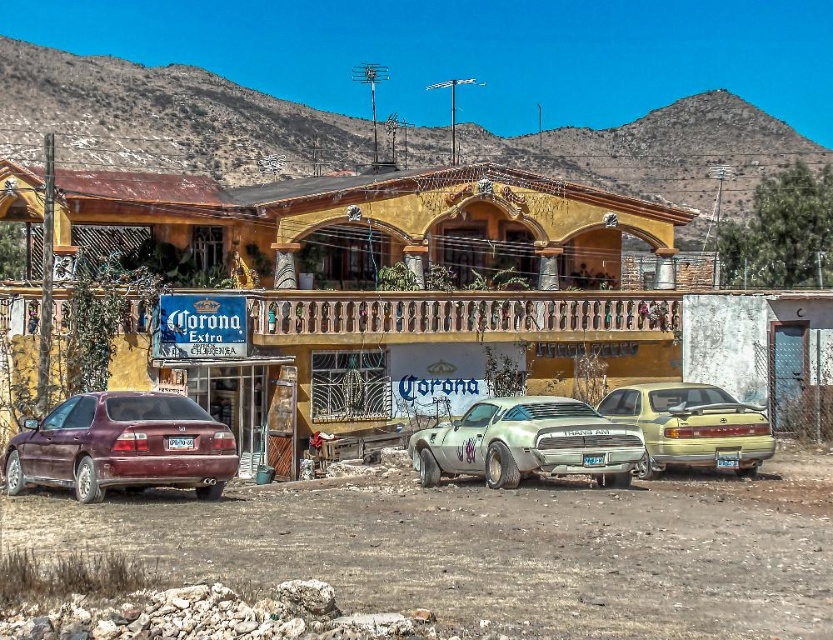
You are a delivery driver who needs to back out of the parking spot in front of the building. The satin burgundy sedan at lower left and the silver metallic muscle car at center are blocking your path. Which vehicle should you move first to exit?

The satin burgundy sedan at lower left is in front of the silver metallic muscle car at center. To exit, you should move the satin burgundy sedan at lower left first, as it is blocking the path in front of the other vehicle.

You are driving a car and want to park in the parking area near the building. The parking area has two cars already parked there. Which car, the satin burgundy sedan at lower left or the metallic gold sedan at right, is closer to the entrance of the building?

The satin burgundy sedan at lower left is closer to the entrance of the building because it is positioned below the metallic gold sedan at right, indicating it is lower in elevation and thus nearer to the entrance.